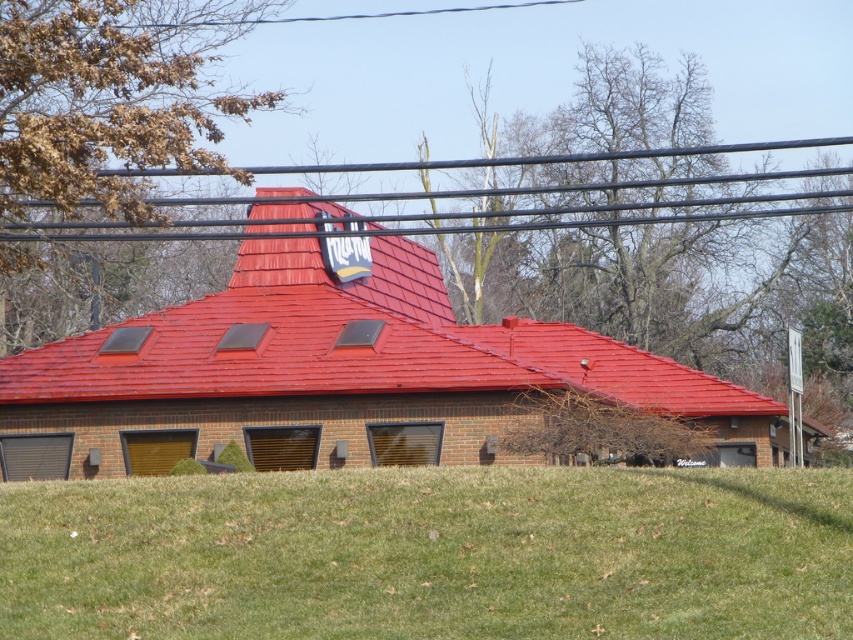
Is green grass at lower center in front of shiny red tile roof at center?

Yes.

Between green grass at lower center and shiny red tile roof at center, which one appears on the left side from the viewer's perspective?

From the viewer's perspective, shiny red tile roof at center appears more on the left side.

Between point (51, 612) and point (544, 346), which one is positioned in front?

Point (51, 612) is more forward.

This screenshot has height=640, width=853. I want to click on green grass at lower center, so click(x=431, y=554).